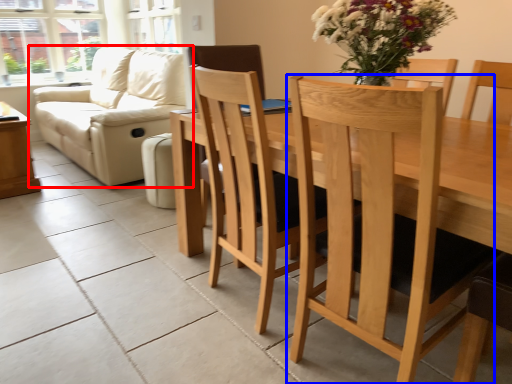
Question: Which point is further to the camera, studio couch (highlighted by a red box) or chair (highlighted by a blue box)?

Choices:
 (A) studio couch
 (B) chair

Answer: (A)